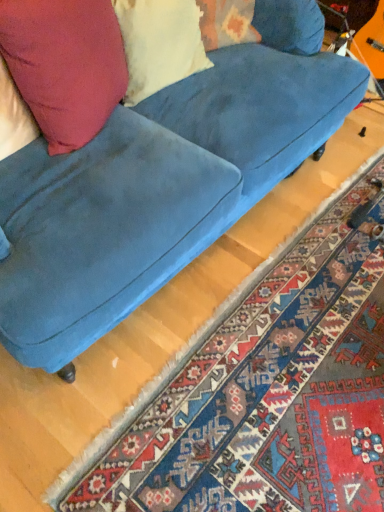
At what (x,y) coordinates should I click in order to perform the action: click on empty space that is ontop of carpet with intricate patterns at lower right (from a real-world perspective). Please return your answer as a coordinate pair (x, y). The width and height of the screenshot is (384, 512). Looking at the image, I should click on 301,354.